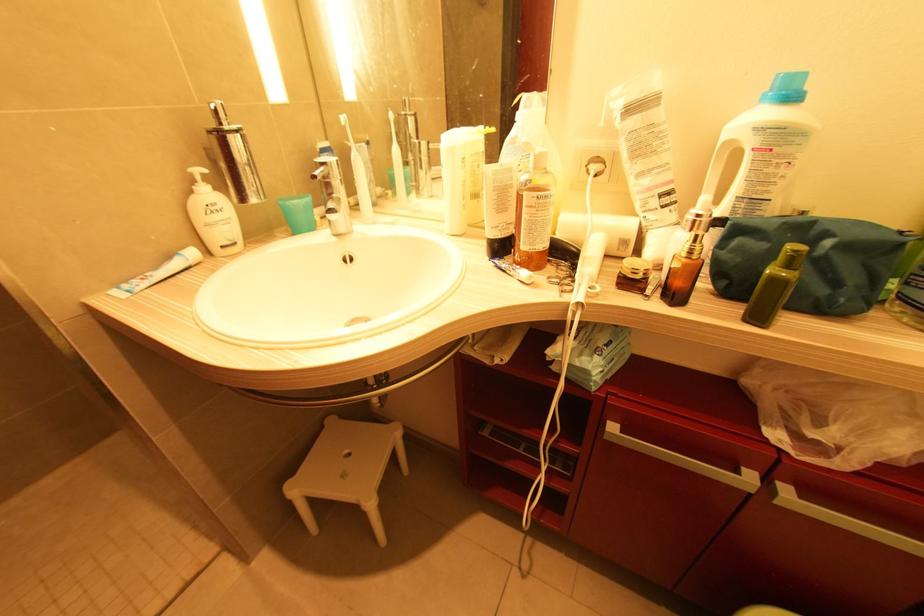
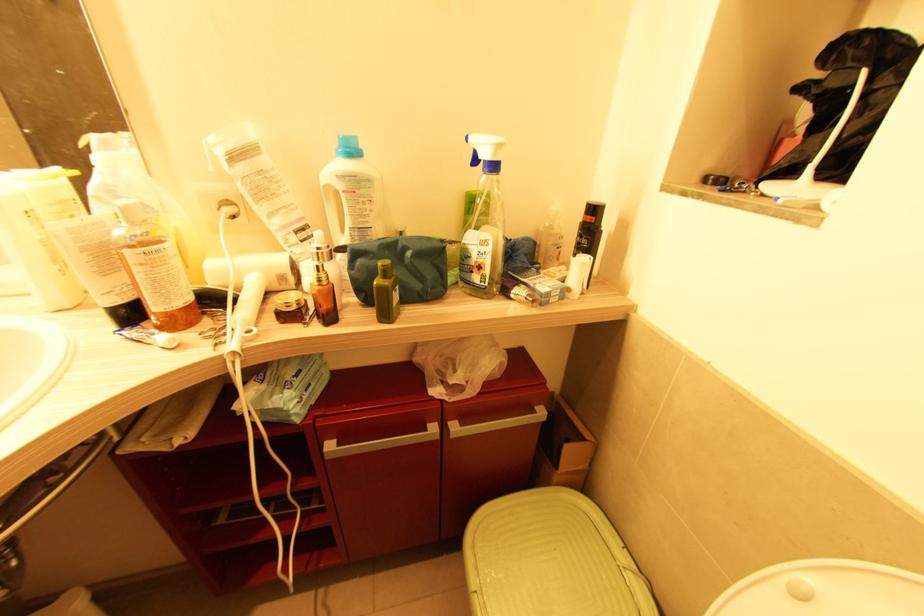
Locate, in the second image, the point that corresponds to point (772, 91) in the first image.

(341, 148)